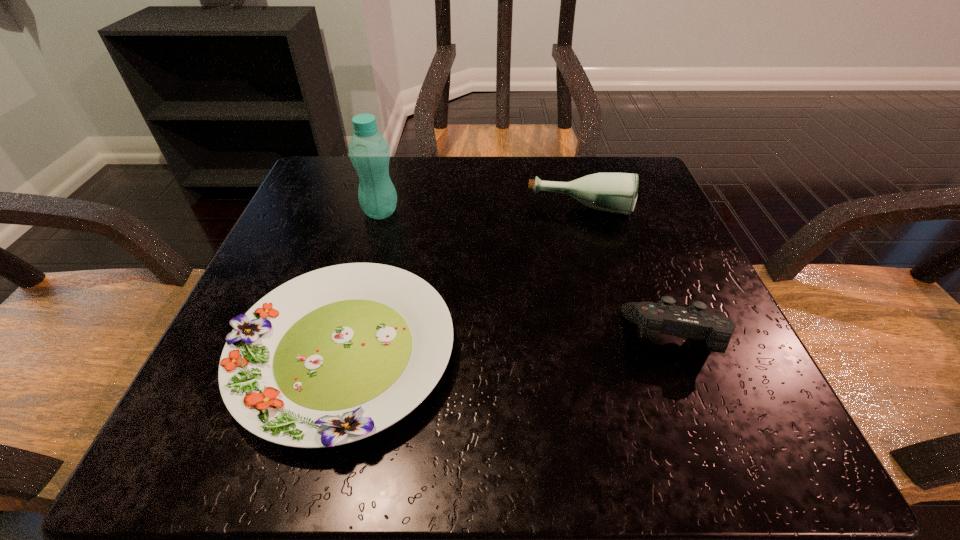
The width and height of the screenshot is (960, 540). In the image, there is a desktop. What are the coordinates of `vacant space at the right edge` in the screenshot? It's located at (620, 249).

Image resolution: width=960 pixels, height=540 pixels. I want to click on free spot at the far left corner of the desktop, so click(x=314, y=197).

Locate an element on the screen. vacant space at the near left corner is located at coordinates (175, 435).

This screenshot has width=960, height=540. Identify the location of vacant point at the far right corner. (602, 212).

In the image, there is a desktop. Identify the location of vacant space at the near right corner. (751, 403).

At what (x,y) coordinates should I click in order to perform the action: click on free area in between the control and the shorter bottle. Please return your answer as a coordinate pair (x, y). Looking at the image, I should click on (629, 274).

At what (x,y) coordinates should I click in order to perform the action: click on unoccupied position between the control and the left bottle. Please return your answer as a coordinate pair (x, y). The height and width of the screenshot is (540, 960). Looking at the image, I should click on (529, 275).

Locate an element on the screen. This screenshot has height=540, width=960. free spot between the control and the salad plate is located at coordinates (511, 346).

What are the coordinates of `empty location between the salad plate and the control` in the screenshot? It's located at (511, 346).

Where is `free area in between the right bottle and the salad plate`? The width and height of the screenshot is (960, 540). free area in between the right bottle and the salad plate is located at coordinates click(462, 281).